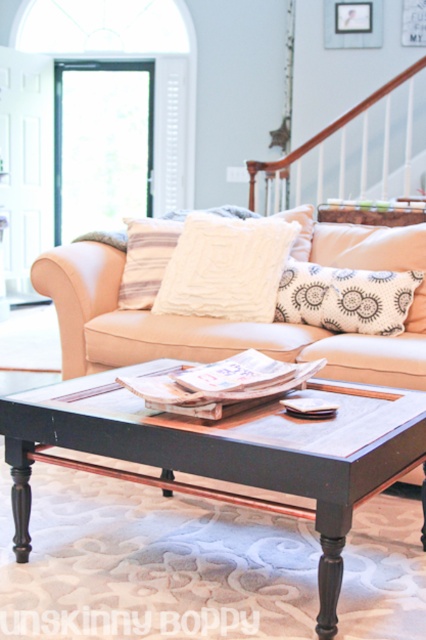
Question: Among these objects, which one is farthest from the camera?

Choices:
 (A) white fuzzy pillow at center
 (B) white textured pillow at center
 (C) striped fabric pillow at center

Answer: (C)

Question: Which point appears farthest from the camera in this image?

Choices:
 (A) (144, 278)
 (B) (359, 243)

Answer: (A)

Question: Which of the following is the farthest from the observer?

Choices:
 (A) white fuzzy pillow at center
 (B) striped fabric pillow at center

Answer: (B)

Question: Is beige fabric couch at center positioned behind white fuzzy pillow at center?

Choices:
 (A) yes
 (B) no

Answer: (B)

Question: Can you confirm if black wood coffee table at center is bigger than white textured pillow at center?

Choices:
 (A) no
 (B) yes

Answer: (B)

Question: Is black wood coffee table at center above striped fabric pillow at center?

Choices:
 (A) no
 (B) yes

Answer: (A)